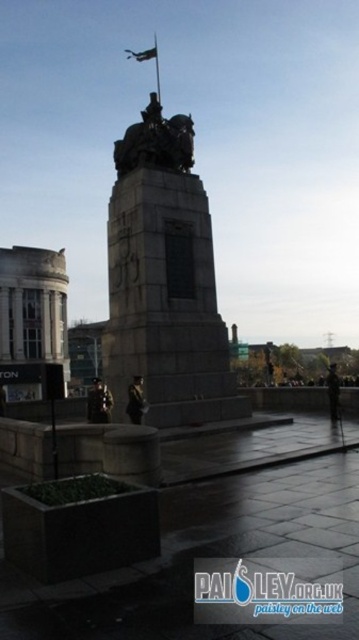
Can you confirm if dark brown uniform at center is taller than dark uniformed figure at center?

Yes.

Who is more distant from viewer, (94, 394) or (336, 381)?

Point (336, 381)

Who is more distant from viewer, (100, 388) or (337, 401)?

Point (337, 401)

Find the location of `dark brown uniform at center`. dark brown uniform at center is located at coordinates (99, 403).

Can you confirm if metallic statue at center is positioned below dark uniformed figure at center?

No.

Looking at this image, which is more to the right, metallic statue at center or dark uniformed figure at center?

Positioned to the right is dark uniformed figure at center.

Is point (136, 396) closer to camera compared to point (332, 387)?

Yes, it is in front of point (332, 387).

You are a GUI agent. You are given a task and a screenshot of the screen. Output one action in this format:
    pyautogui.click(x=<x>, y=<y>)
    Task: Click on the metallic statue at center
    The image size is (359, 640).
    Given the screenshot: What is the action you would take?
    pyautogui.click(x=136, y=401)

Is metallic statue at center shorter than metallic flag at upper center?

Yes.

Does metallic statue at center have a greater height compared to metallic flag at upper center?

No.

The image size is (359, 640). Describe the element at coordinates (136, 401) in the screenshot. I see `metallic statue at center` at that location.

In order to click on metallic statue at center in this screenshot , I will do `click(136, 401)`.